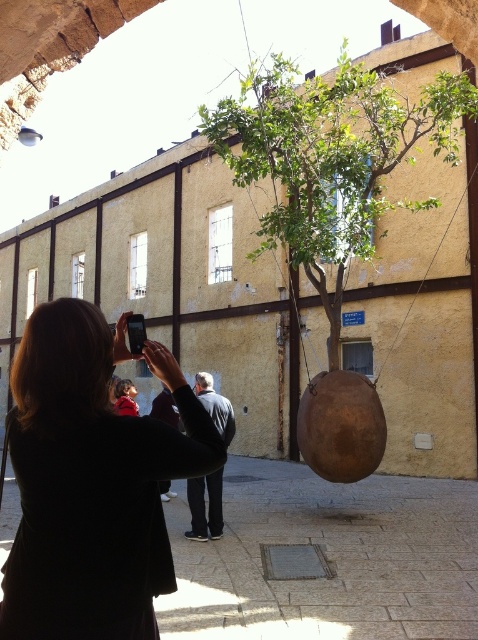
Question: Does matte black jacket at left have a smaller size compared to dark gray jacket at center?

Choices:
 (A) yes
 (B) no

Answer: (B)

Question: Which object is the closest to the green leafy tree at center?

Choices:
 (A) dark gray jacket at center
 (B) matte black jacket at left

Answer: (A)

Question: Among these points, which one is nearest to the camera?

Choices:
 (A) 365,100
 (B) 134,432
 (C) 215,483

Answer: (B)

Question: Can you confirm if matte black jacket at left is smaller than dark gray jacket at center?

Choices:
 (A) yes
 (B) no

Answer: (B)

Question: Which of the following is the farthest from the observer?

Choices:
 (A) green leafy tree at center
 (B) matte black jacket at left

Answer: (A)

Question: Can you confirm if matte black jacket at left is smaller than dark gray jacket at center?

Choices:
 (A) yes
 (B) no

Answer: (B)